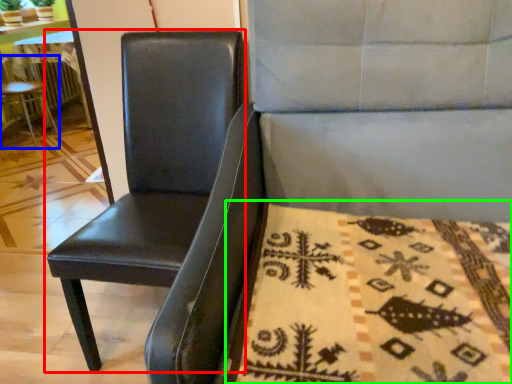
Question: Estimate the real-world distances between objects in this image. Which object is farther from chair (highlighted by a red box), chair (highlighted by a blue box) or blanket (highlighted by a green box)?

Choices:
 (A) chair
 (B) blanket

Answer: (A)